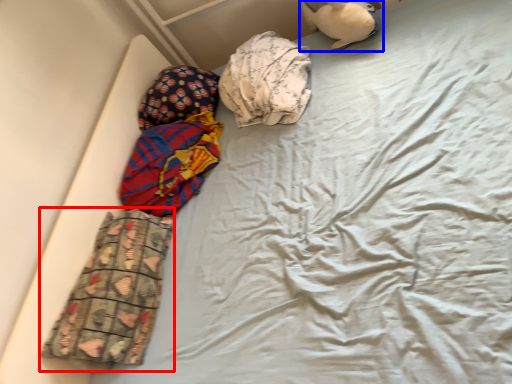
Question: Which of the following is the farthest to the observer, material (highlighted by a red box) or toy (highlighted by a blue box)?

Choices:
 (A) material
 (B) toy

Answer: (B)